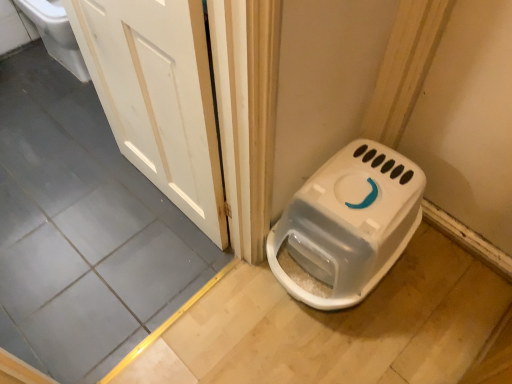
This screenshot has height=384, width=512. In order to click on white plastic litter box at lower right in this screenshot , I will do `click(349, 223)`.

What do you see at coordinates (349, 223) in the screenshot? The image size is (512, 384). I see `white plastic litter box at lower right` at bounding box center [349, 223].

This screenshot has width=512, height=384. Find the location of `white wood door at upper left`. white wood door at upper left is located at coordinates (158, 97).

Describe the element at coordinates (158, 97) in the screenshot. The height and width of the screenshot is (384, 512). I see `white wood door at upper left` at that location.

Measure the distance between point [115,83] and camera.

The distance of point [115,83] from camera is 1.38 meters.

This screenshot has width=512, height=384. In order to click on white plastic litter box at lower right in this screenshot , I will do `click(349, 223)`.

Looking at this image, considering the relative positions of white plastic litter box at lower right and white wood door at upper left in the image provided, is white plastic litter box at lower right to the left or to the right of white wood door at upper left?

In the image, white plastic litter box at lower right appears on the right side of white wood door at upper left.

Is white plastic litter box at lower right positioned before white wood door at upper left?

No, it is behind white wood door at upper left.

Between point (387, 207) and point (212, 206), which one is positioned behind?

The point (212, 206) is farther.

In the scene shown: From the image's perspective, which object appears higher, white plastic litter box at lower right or white wood door at upper left?

white wood door at upper left.

From a real-world perspective, between white plastic litter box at lower right and white wood door at upper left, who is vertically lower?

From a 3D spatial view, white plastic litter box at lower right is below.

Which of these two, white plastic litter box at lower right or white wood door at upper left, is thinner?

white wood door at upper left is thinner.

From their relative heights in the image, would you say white plastic litter box at lower right is taller or shorter than white wood door at upper left?

Considering their sizes, white plastic litter box at lower right has less height than white wood door at upper left.

Between white plastic litter box at lower right and white wood door at upper left, which one has larger size?

white plastic litter box at lower right is bigger.

Is white wood door at upper left surrounded by white plastic litter box at lower right?

That's incorrect, white wood door at upper left is not inside white plastic litter box at lower right.

Is white plastic litter box at lower right far away from white wood door at upper left?

No, white plastic litter box at lower right is not far away from white wood door at upper left.

Is white wood door at upper left at the back of white plastic litter box at lower right?

No, white plastic litter box at lower right is not facing away from white wood door at upper left.

The height and width of the screenshot is (384, 512). Identify the location of door in front of the white plastic litter box at lower right. (158, 97).

Which object is positioned more to the left, white wood door at upper left or white plastic litter box at lower right?

From the viewer's perspective, white wood door at upper left appears more on the left side.

Between white wood door at upper left and white plastic litter box at lower right, which one is positioned behind?

white plastic litter box at lower right is further from the camera.

Is point (123, 122) positioned in front of point (344, 189)?

That is False.

From the image's perspective, is white wood door at upper left positioned above or below white plastic litter box at lower right?

white wood door at upper left is above white plastic litter box at lower right.

From a real-world perspective, is white wood door at upper left on white plastic litter box at lower right?

Yes, from a real-world perspective, white wood door at upper left is on top of white plastic litter box at lower right.

Between white wood door at upper left and white plastic litter box at lower right, which one has larger width?

white plastic litter box at lower right is wider.

Can you confirm if white wood door at upper left is taller than white plastic litter box at lower right?

Yes.

Considering the sizes of objects white wood door at upper left and white plastic litter box at lower right in the image provided, who is smaller, white wood door at upper left or white plastic litter box at lower right?

With smaller size is white wood door at upper left.

Is white wood door at upper left inside the boundaries of white plastic litter box at lower right, or outside?

The correct answer is: outside.

Is the surface of white wood door at upper left in direct contact with white plastic litter box at lower right?

No.

Is white wood door at upper left looking in the opposite direction of white plastic litter box at lower right?

white wood door at upper left is not turned away from white plastic litter box at lower right.

How far apart are white wood door at upper left and white plastic litter box at lower right?

The distance of white wood door at upper left from white plastic litter box at lower right is 18.66 inches.

Locate an element on the screen. door on the left of the white plastic litter box at lower right is located at coordinates (158, 97).

This screenshot has height=384, width=512. Find the location of `toilet below the white wood door at upper left (from a real-world perspective)`. toilet below the white wood door at upper left (from a real-world perspective) is located at coordinates (349, 223).

Where is `door that appears on the left of white plastic litter box at lower right`? The width and height of the screenshot is (512, 384). door that appears on the left of white plastic litter box at lower right is located at coordinates (158, 97).